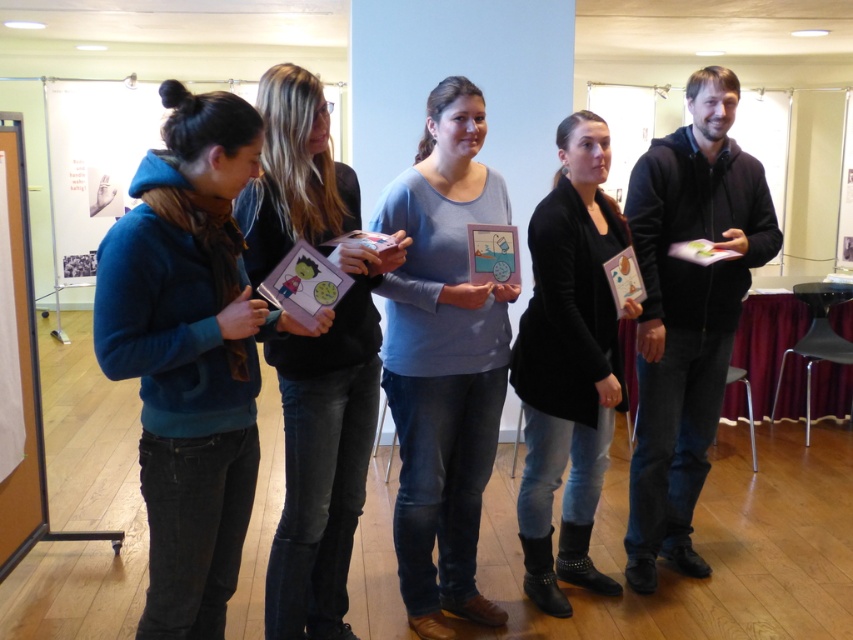
You are a photographer in the conference room. You want to take a photo of the light blue sweater at center and the matte black card at center so that both are clearly visible. Considering their heights, which object should you focus on first to ensure proper focus?

The light blue sweater at center is much taller than the matte black card at center, so you should focus on the light blue sweater at center first to ensure proper focus.

You are standing in the conference room and need to place a new object exactly where the matte black card at center is located. According to the coordinates provided, where should you place the new object?

You should place the new object at the coordinates point (325, 454) where the matte black card at center is located.